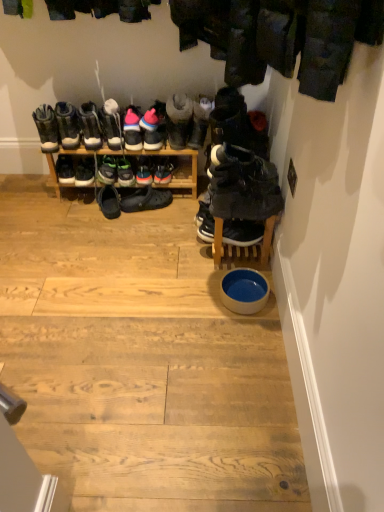
You are a GUI agent. You are given a task and a screenshot of the screen. Output one action in this format:
    pyautogui.click(x=<x>, y=<y>)
    Task: Click on the vacant space situated above white glossy bowl at center (from a real-world perspective)
    
    Given the screenshot: What is the action you would take?
    pyautogui.click(x=140, y=315)